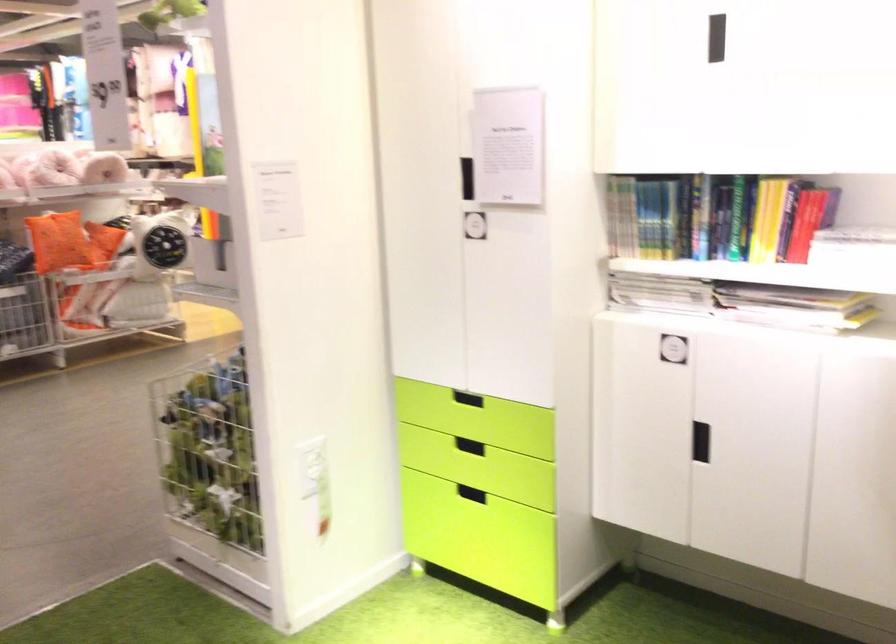
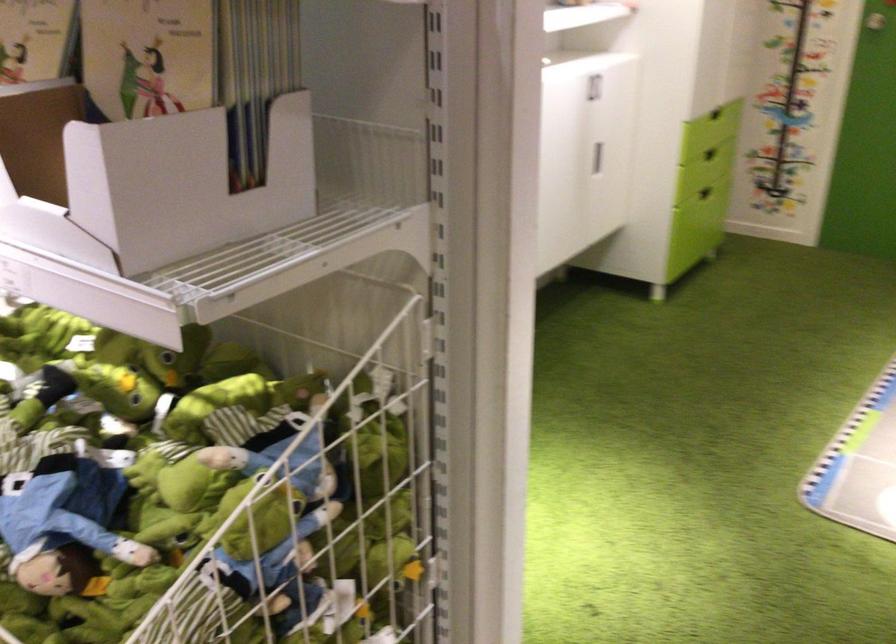
Question: I am providing you with two images of the same scene from different viewpoints. Please identify which objects are invisible in image2.

Choices:
 (A) red t-shaped handle
 (B) thin book
 (C) green drawer handle
 (D) recessed black handle

Answer: (D)